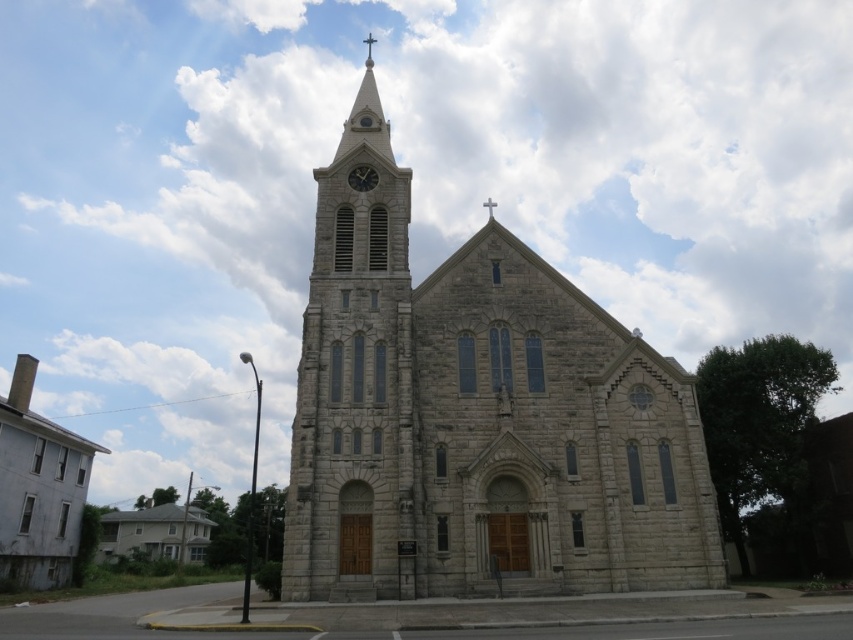
Who is more forward, (378, 355) or (374, 230)?

Point (378, 355)

At what (x,y) coordinates should I click in order to perform the action: click on gray stone church at center. Please return your answer as a coordinate pair (x, y). This screenshot has height=640, width=853. Looking at the image, I should click on (477, 417).

Between gray stone church at center and matte gray clock at center, which one has less height?

With less height is matte gray clock at center.

From the picture: Does gray stone church at center have a greater height compared to matte gray clock at center?

Yes, gray stone church at center is taller than matte gray clock at center.

Is point (426, 324) positioned before point (364, 188)?

Yes, point (426, 324) is in front of point (364, 188).

Locate an element on the screen. This screenshot has width=853, height=640. gray stone church at center is located at coordinates (477, 417).

Who is positioned more to the left, gray stone clock tower at center-left or matte gray clock at center?

From the viewer's perspective, gray stone clock tower at center-left appears more on the left side.

Where is `gray stone clock tower at center-left`? gray stone clock tower at center-left is located at coordinates (357, 384).

Between point (369, 582) and point (373, 177), which one is positioned behind?

The point (373, 177) is more distant.

I want to click on gray stone clock tower at center-left, so click(x=357, y=384).